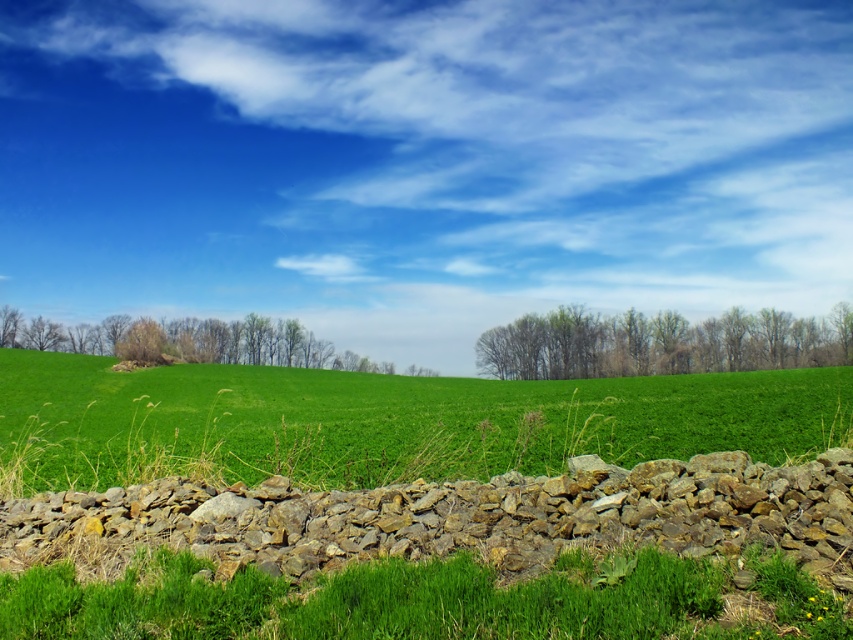
Looking at this image, is rustic stone wall at center further to camera compared to green leafy trees at center?

No.

Can you confirm if rustic stone wall at center is positioned below green leafy trees at center?

Correct, rustic stone wall at center is located below green leafy trees at center.

Who is more distant from viewer, (637, 516) or (537, 323)?

The point (537, 323) is behind.

Find the location of `rustic stone wall at center`. rustic stone wall at center is located at coordinates (467, 515).

Does green leafy trees at center have a smaller size compared to green leafy tree at left?

Correct, green leafy trees at center occupies less space than green leafy tree at left.

Does green leafy trees at center have a greater height compared to green leafy tree at left?

Yes, green leafy trees at center is taller than green leafy tree at left.

You are a GUI agent. You are given a task and a screenshot of the screen. Output one action in this format:
    pyautogui.click(x=<x>, y=<y>)
    Task: Click on the green leafy trees at center
    The width and height of the screenshot is (853, 640).
    Given the screenshot: What is the action you would take?
    [x=659, y=342]

Is green grassy field at center closer to camera compared to green leafy tree at left?

Yes, green grassy field at center is in front of green leafy tree at left.

Who is higher up, green grassy field at center or green leafy tree at left?

green leafy tree at left is above.

Does point (836, 404) lie in front of point (131, 352)?

That is True.

Find the location of `green grassy field at center`. green grassy field at center is located at coordinates (384, 420).